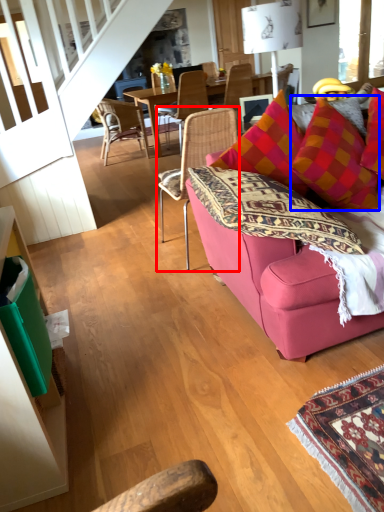
Question: Which point is further to the camera, chair (highlighted by a red box) or throw pillow (highlighted by a blue box)?

Choices:
 (A) chair
 (B) throw pillow

Answer: (A)